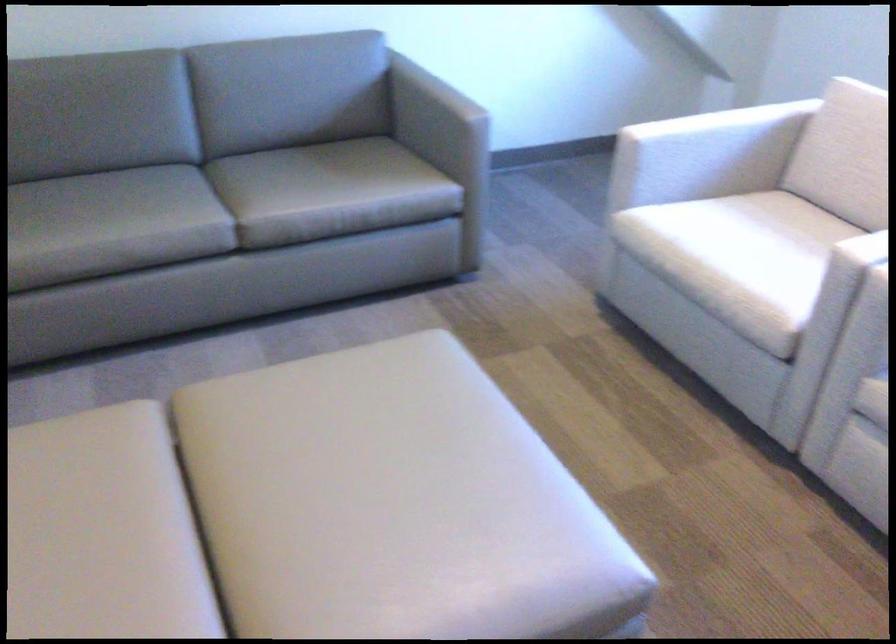
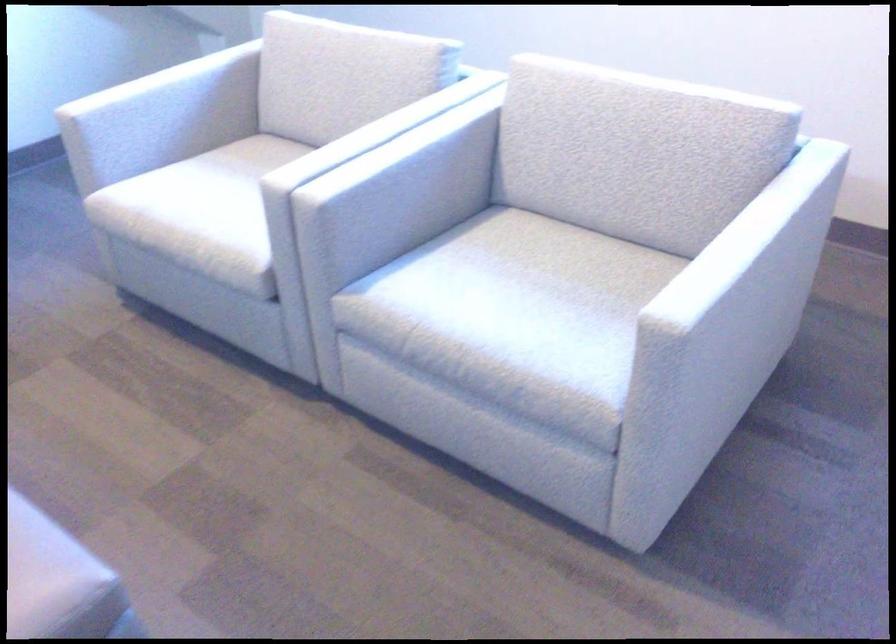
Locate, in the second image, the point that corresponds to the point at 703,137 in the first image.

(150, 96)